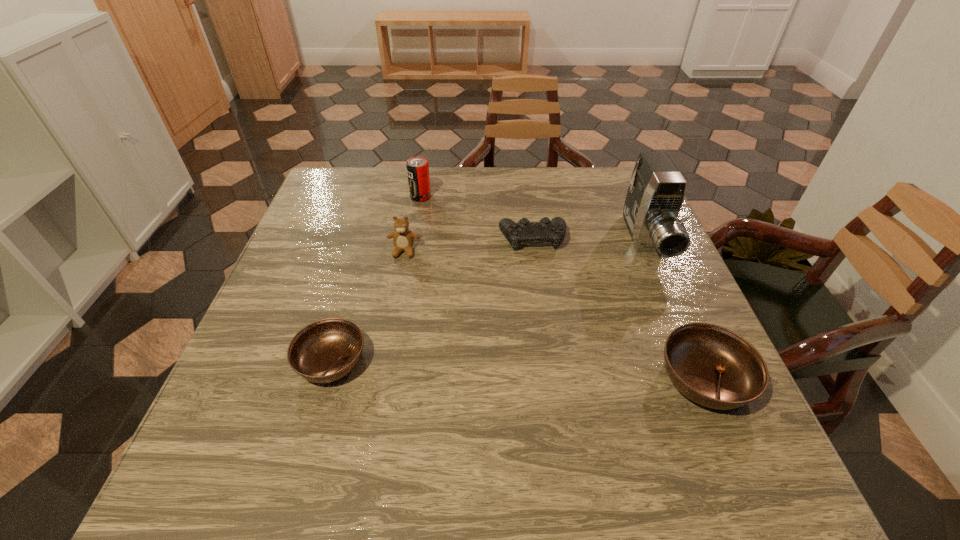
Find the location of `free space at the far edge`. free space at the far edge is located at coordinates (461, 201).

In the image, there is a desktop. Find the location of `free space at the near edge`. free space at the near edge is located at coordinates (453, 421).

At what (x,y) coordinates should I click in order to perform the action: click on vacant area at the left edge. Please return your answer as a coordinate pair (x, y). Looking at the image, I should click on (242, 348).

At what (x,y) coordinates should I click in order to perform the action: click on free space at the right edge of the desktop. Please return your answer as a coordinate pair (x, y). The height and width of the screenshot is (540, 960). Looking at the image, I should click on (660, 274).

This screenshot has width=960, height=540. Find the location of `vacant space that's between the teddy bear and the shortest object`. vacant space that's between the teddy bear and the shortest object is located at coordinates (368, 306).

Find the location of a particular element. free space between the second tallest object and the tallest object is located at coordinates coord(533,219).

At what (x,y) coordinates should I click in order to perform the action: click on vacant area that lies between the shorter soup bowl and the can. Please return your answer as a coordinate pair (x, y). Looking at the image, I should click on (376, 279).

Where is `unoccupied area between the camcorder and the right soup bowl`? unoccupied area between the camcorder and the right soup bowl is located at coordinates (675, 309).

This screenshot has width=960, height=540. Find the location of `vacant region between the camcorder and the right soup bowl`. vacant region between the camcorder and the right soup bowl is located at coordinates (675, 309).

Identify the location of free space between the right soup bowl and the control. (618, 308).